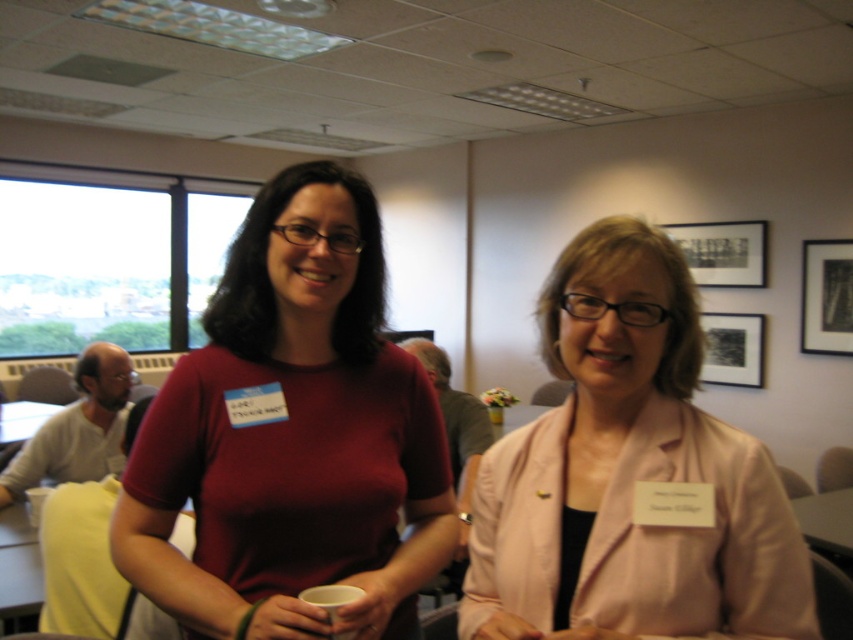
This screenshot has width=853, height=640. In order to click on matte red shirt at center in this screenshot , I will do [x=291, y=435].

Does matte red shirt at center have a lesser width compared to pink fabric jacket at center?

No, matte red shirt at center is not thinner than pink fabric jacket at center.

Identify the location of matte red shirt at center. (291, 435).